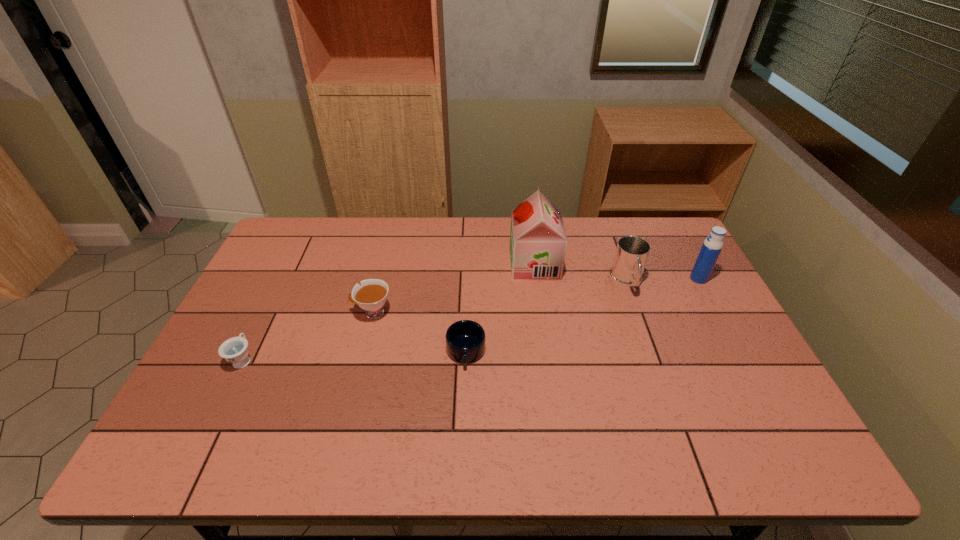
Locate an element on the screen. The width and height of the screenshot is (960, 540). the third object from right to left is located at coordinates (538, 242).

Identify the location of the tallest object. The image size is (960, 540). (538, 242).

You are a GUI agent. You are given a task and a screenshot of the screen. Output one action in this format:
    pyautogui.click(x=<x>, y=<y>)
    Task: Click on the rightmost object
    Image resolution: width=960 pixels, height=540 pixels.
    Given the screenshot: What is the action you would take?
    pyautogui.click(x=713, y=244)

The width and height of the screenshot is (960, 540). I want to click on water bottle, so click(713, 244).

The width and height of the screenshot is (960, 540). What are the coordinates of `the fourth shortest object` in the screenshot? It's located at (630, 258).

Locate an element on the screen. This screenshot has height=540, width=960. the farther mug is located at coordinates (630, 258).

Image resolution: width=960 pixels, height=540 pixels. What are the coordinates of `the farther teacup` in the screenshot? It's located at (371, 295).

I want to click on the right teacup, so click(x=371, y=295).

This screenshot has height=540, width=960. Find the location of `the shorter teacup`. the shorter teacup is located at coordinates (235, 350).

At what (x,y) coordinates should I click in order to perform the action: click on the leftmost object. Please return your answer as a coordinate pair (x, y). The image size is (960, 540). Looking at the image, I should click on (235, 350).